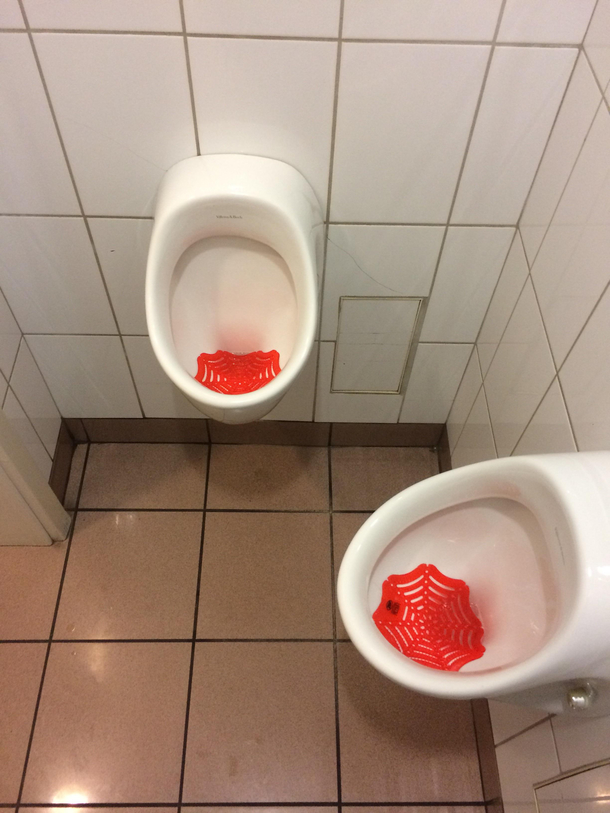
Locate an element on the screen. Image resolution: width=610 pixels, height=813 pixels. white porcelain urinal is located at coordinates (587, 532), (220, 193).